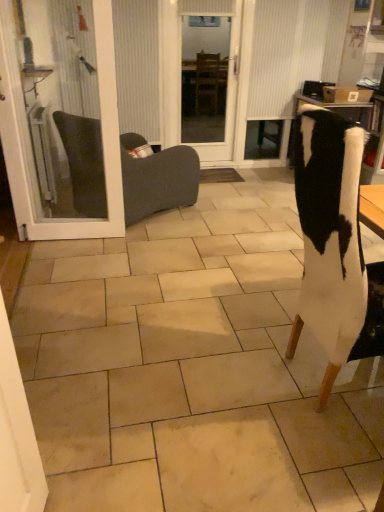
Image resolution: width=384 pixels, height=512 pixels. Find the location of `free location to the right of white glass door at left`. free location to the right of white glass door at left is located at coordinates (135, 244).